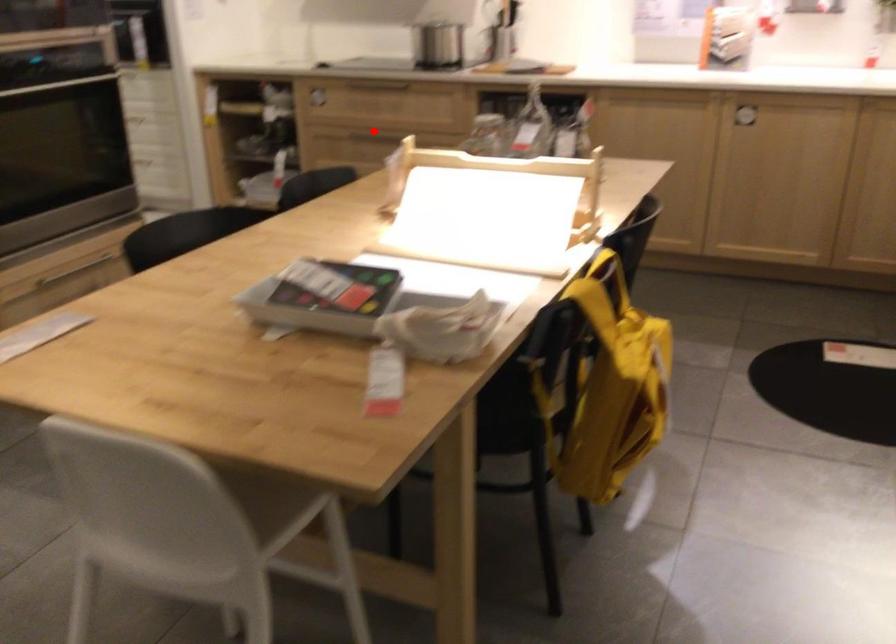
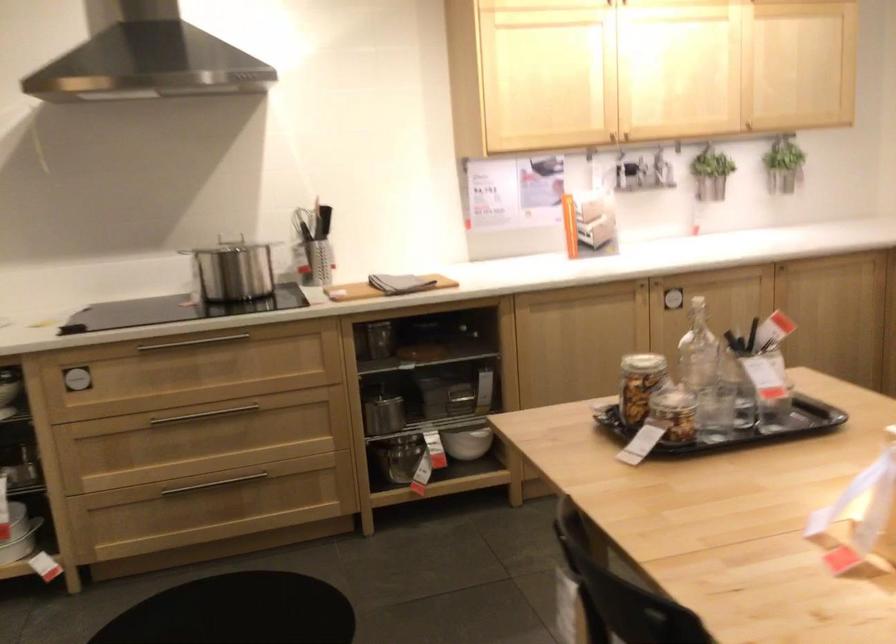
Question: I am providing you with two images of the same scene from different viewpoints. A red point is shown in image1. For the corresponding object point in image2, is it positioned nearer or farther from the camera?

Choices:
 (A) Nearer
 (B) Farther

Answer: (A)